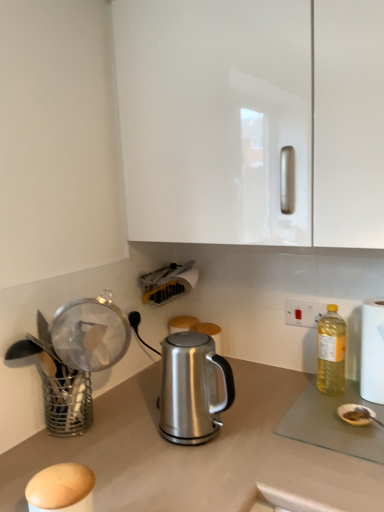
Question: From a real-world perspective, is satin silver kettle at center above or below white glossy cabinet at upper center?

Choices:
 (A) below
 (B) above

Answer: (A)

Question: Does point (175, 351) appear closer or farther from the camera than point (304, 15)?

Choices:
 (A) farther
 (B) closer

Answer: (A)

Question: Estimate the real-world distances between objects in this image. Which object is closer to the white plastic electric outlet at upper right?

Choices:
 (A) white paper towel at right
 (B) metallic wire basket at left
 (C) yellow translucent bottle at right
 (D) white glossy cabinet at upper center
 (E) satin silver kettle at center

Answer: (C)

Question: Which of these objects is positioned farthest from the white paper towel at right?

Choices:
 (A) metallic wire basket at left
 (B) yellow translucent bottle at right
 (C) white glossy cabinet at upper center
 (D) white plastic electric outlet at upper right
 (E) satin silver kettle at center

Answer: (A)